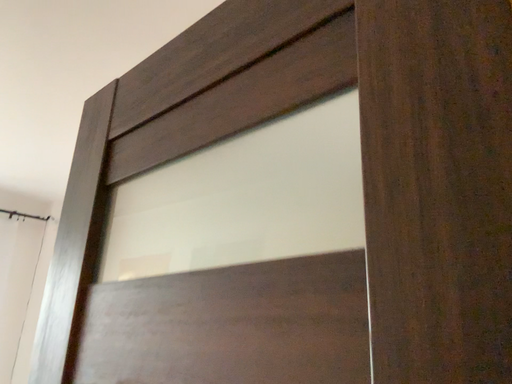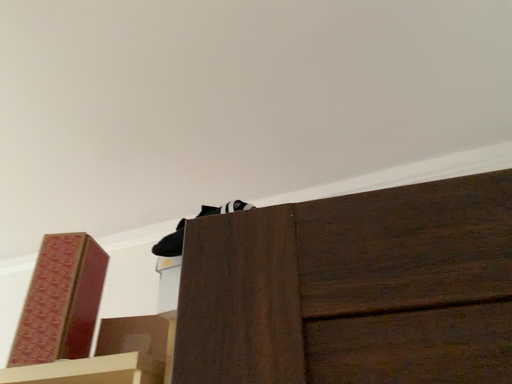
Question: Which way did the camera rotate in the video?

Choices:
 (A) rotated upward
 (B) rotated downward

Answer: (A)